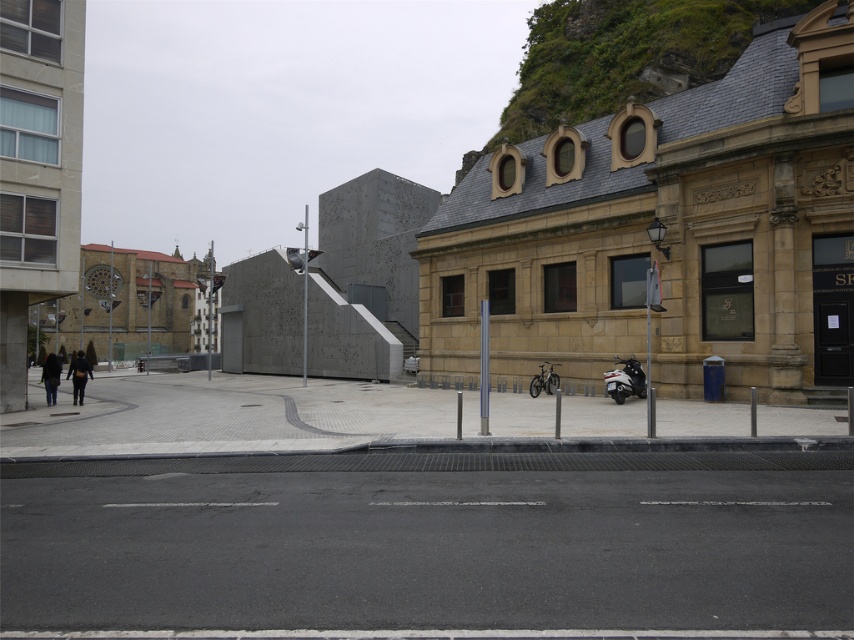
Question: In this image, where is shiny silver motorcycle at lower right located relative to dark gray coat at left?

Choices:
 (A) right
 (B) left

Answer: (A)

Question: Among these points, which one is farthest from the camera?

Choices:
 (A) (79, 364)
 (B) (45, 378)
 (C) (542, 372)
 (D) (612, 372)

Answer: (A)

Question: Which of the following is the farthest from the observer?

Choices:
 (A) dark gray coat at left
 (B) dark blue fabric jacket at lower left

Answer: (B)

Question: Is dark blue fabric jacket at lower left smaller than shiny silver motorcycle at center?

Choices:
 (A) no
 (B) yes

Answer: (A)

Question: Is shiny silver motorcycle at lower right below dark gray coat at left?

Choices:
 (A) yes
 (B) no

Answer: (B)

Question: Considering the real-world distances, which object is farthest from the shiny silver motorcycle at center?

Choices:
 (A) dark blue fabric jacket at lower left
 (B) shiny silver motorcycle at lower right
 (C) dark gray coat at left

Answer: (A)